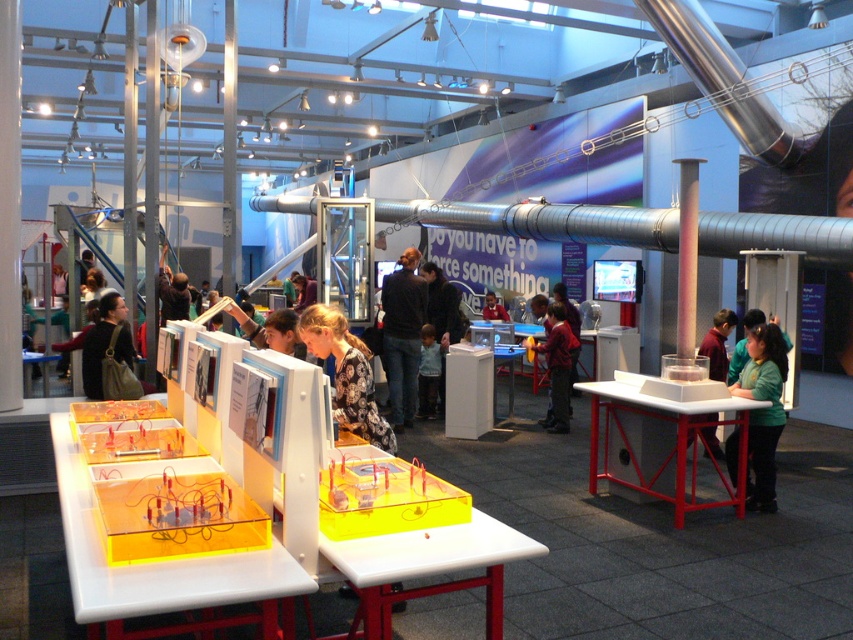
You are navigating an indoor science exhibit space and need to locate the white plastic table at center. According to the coordinates provided, where would you find it?

The white plastic table at center is located at coordinates point [660,444].

You are a museum visitor trying to compare two yellow boxes in the science exhibit. The first is labeled as translucent yellow plastic at center and the second is transparent yellow plastic at center. Which one is wider?

The translucent yellow plastic at center is wider than the transparent yellow plastic at center.